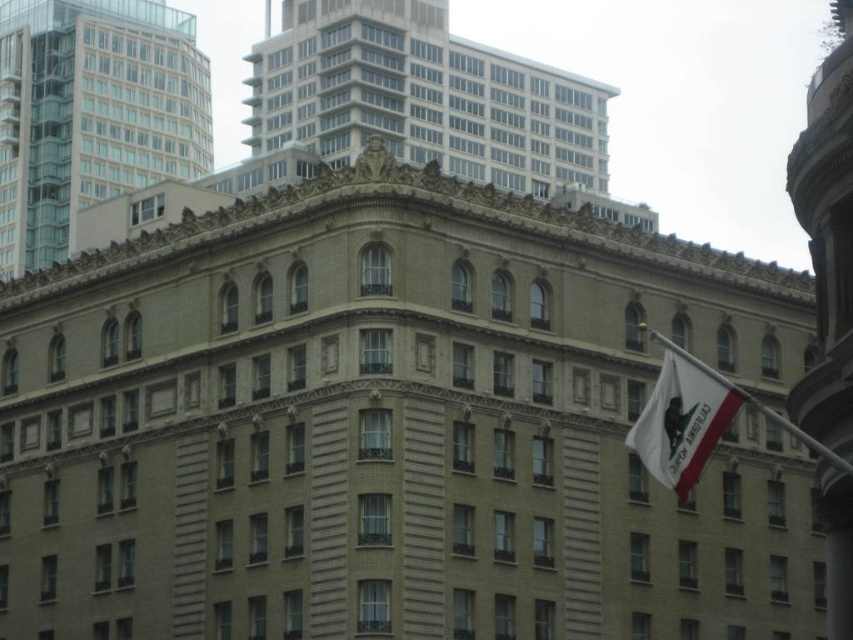
You are standing in front of the building and want to hang a banner that reaches from the top of the smooth concrete building at upper center to the bottom of the white fabric flag at right. Will the banner be longer than 10 meters?

The smooth concrete building at upper center is much taller than the white fabric flag at right, so the banner would need to be longer than 10 meters to reach from the top of the building to the bottom of the flag.

You are standing in front of the building and want to take a photo of both the smooth concrete building at upper center and the smooth glass windows at upper left. Which object will appear larger in the photo?

The smooth concrete building at upper center will appear larger in the photo because it is closer to the viewer than the smooth glass windows at upper left.

You are standing in front of the building and want to compare the sizes of the objects. Which one is wider between the smooth glass windows at upper left and the white fabric flag at right?

The smooth glass windows at upper left are wider than the white fabric flag at right according to the description.